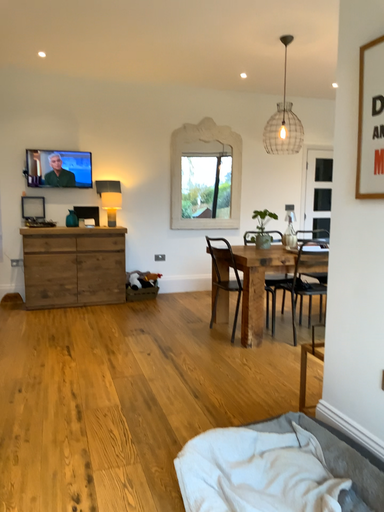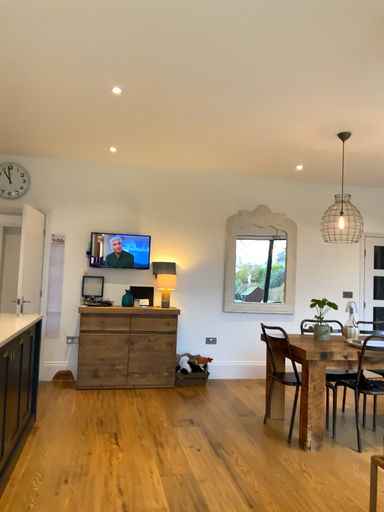
Question: Which way did the camera rotate in the video?

Choices:
 (A) rotated right
 (B) rotated left

Answer: (B)